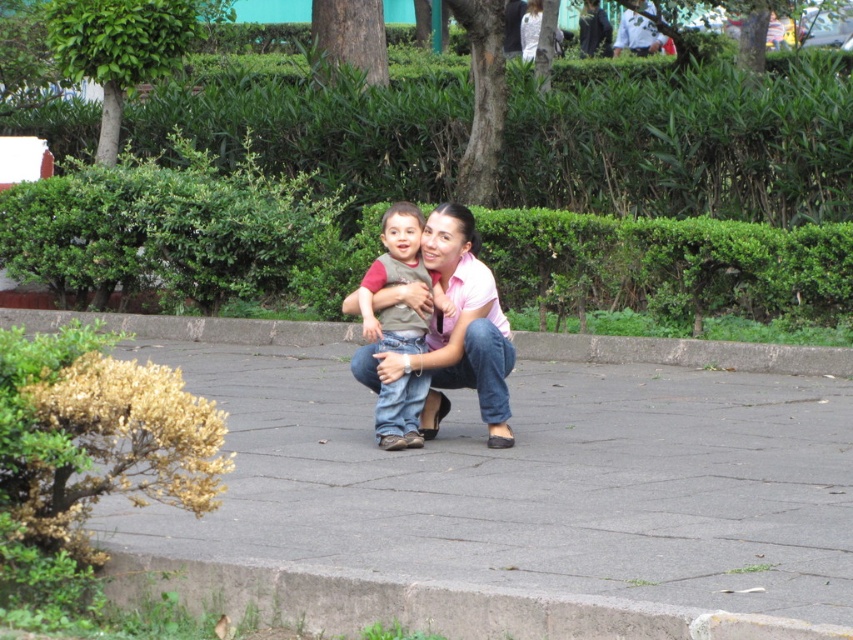
Does gray concrete pavement at center lie in front of concrete at center?

Yes, gray concrete pavement at center is in front of concrete at center.

Does gray concrete pavement at center have a lesser height compared to concrete at center?

Correct, gray concrete pavement at center is not as tall as concrete at center.

Is point (587, 385) less distant than point (540, 342)?

Yes, it is.

Find the location of `gray concrete pavement at center`. gray concrete pavement at center is located at coordinates (515, 502).

Measure the distance between concrete at center and matte brown vest at center.

A distance of 18.76 feet exists between concrete at center and matte brown vest at center.

Who is taller, concrete at center or matte brown vest at center?

With more height is matte brown vest at center.

What do you see at coordinates (685, 353) in the screenshot?
I see `concrete at center` at bounding box center [685, 353].

Find the location of a particular element. This screenshot has height=640, width=853. concrete at center is located at coordinates (685, 353).

Between gray concrete pavement at center and matte brown vest at center, which one has less height?

With less height is gray concrete pavement at center.

Does gray concrete pavement at center have a greater height compared to matte brown vest at center?

In fact, gray concrete pavement at center may be shorter than matte brown vest at center.

Is point (376, 474) behind point (387, 340)?

That is False.

Locate an element on the screen. This screenshot has height=640, width=853. gray concrete pavement at center is located at coordinates (515, 502).